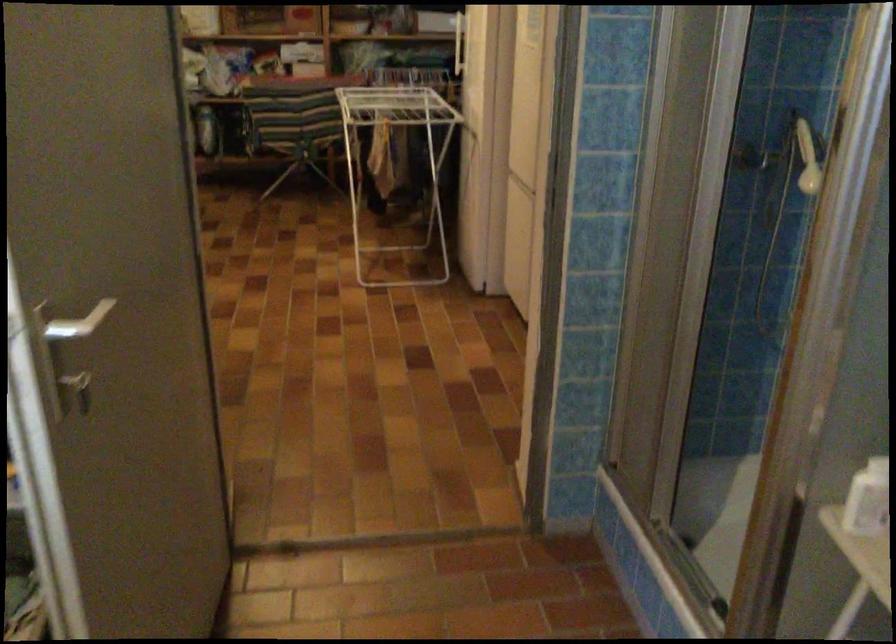
Describe the element at coordinates (754, 160) in the screenshot. I see `the shower door handle` at that location.